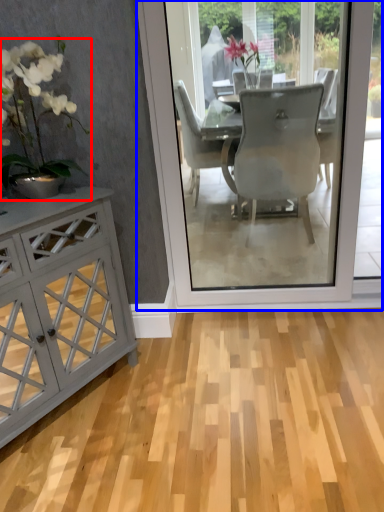
Question: Which object appears closest to the camera in this image, houseplant (highlighted by a red box) or screen door (highlighted by a blue box)?

Choices:
 (A) houseplant
 (B) screen door

Answer: (A)